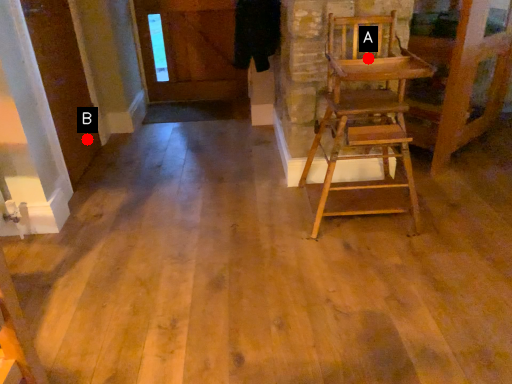
Question: Two points are circled on the image, labeled by A and B beside each circle. Among these points, which one is nearest to the camera?

Choices:
 (A) A is closer
 (B) B is closer

Answer: (A)